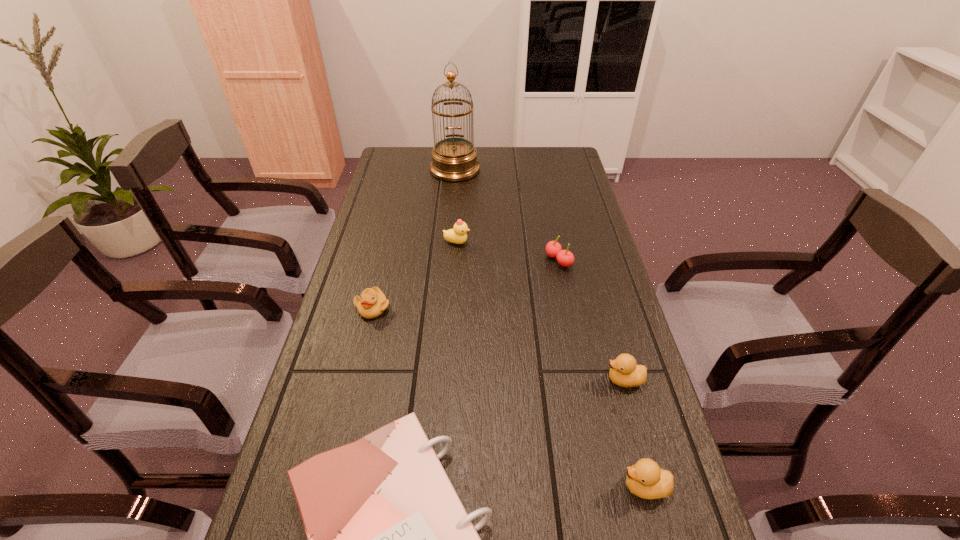
You are a GUI agent. You are given a task and a screenshot of the screen. Output one action in this format:
    pyautogui.click(x=<x>, y=<y>)
    Task: Click on the farthest object
    
    Given the screenshot: What is the action you would take?
    pyautogui.click(x=453, y=159)

Find the location of `the tallest object`. the tallest object is located at coordinates (453, 159).

Image resolution: width=960 pixels, height=540 pixels. I want to click on the second farthest object, so click(x=458, y=235).

At what (x,y) coordinates should I click in order to perform the action: click on the third duckling from right to left. Please return your answer as a coordinate pair (x, y). Looking at the image, I should click on (458, 235).

At what (x,y) coordinates should I click in order to perform the action: click on the fifth nearest object. Please return your answer as a coordinate pair (x, y). The width and height of the screenshot is (960, 540). Looking at the image, I should click on (565, 258).

You are a GUI agent. You are given a task and a screenshot of the screen. Output one action in this format:
    pyautogui.click(x=<x>, y=<y>)
    Task: Click on the nearest duckling
    The image size is (960, 540).
    Given the screenshot: What is the action you would take?
    pyautogui.click(x=645, y=479)

Locate an element on the screen. The width and height of the screenshot is (960, 540). the third nearest object is located at coordinates (624, 372).

Where is `the third nearest duckling`? The height and width of the screenshot is (540, 960). the third nearest duckling is located at coordinates (372, 303).

Image resolution: width=960 pixels, height=540 pixels. What are the coordinates of `the fourth nearest object` in the screenshot? It's located at (372, 303).

At what (x,y) coordinates should I click in order to perform the action: click on free space located with an open door on the birdcage. Please return your answer as a coordinate pair (x, y). This screenshot has height=540, width=960. Looking at the image, I should click on (449, 245).